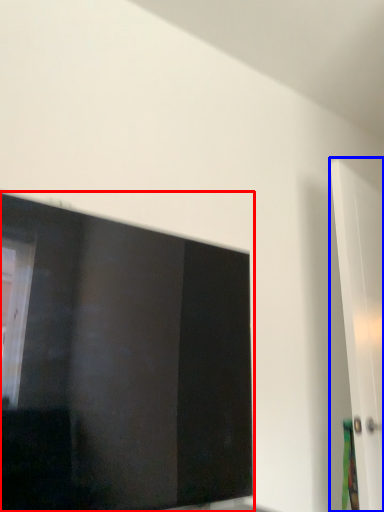
Question: Which of the following is the farthest to the observer, window (highlighted by a red box) or door (highlighted by a blue box)?

Choices:
 (A) window
 (B) door

Answer: (B)